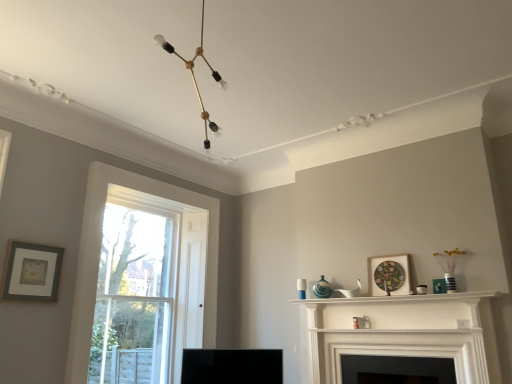
Where is `free spot above white matte fireplace at center, which is the 1th fireplace from top to bottom (from a real-world perspective)`? free spot above white matte fireplace at center, which is the 1th fireplace from top to bottom (from a real-world perspective) is located at coordinates (392, 304).